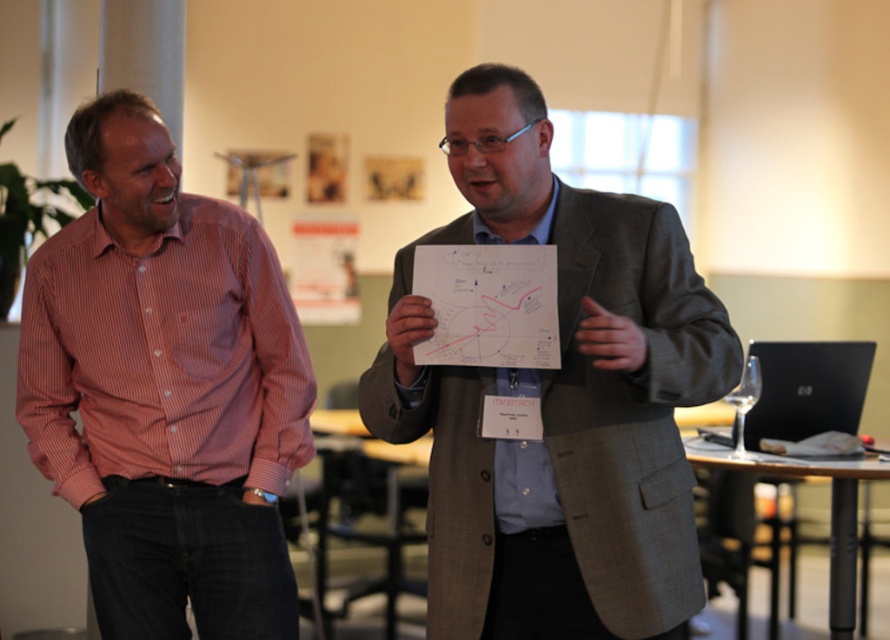
Looking at this image, you are trying to determine which man is shorter based on the scene. Both the matte pink shirt at left and the pink striped shirt at left are present. Which one is shorter?

The matte pink shirt at left is shorter than the pink striped shirt at left according to the description.

You are a fashion designer observing two men in a casual meeting. The men are wearing the matte pink shirt at left and the pink striped shirt at left. Which of these shirts has a larger size?

The matte pink shirt at left has a larger size compared to the pink striped shirt at left.